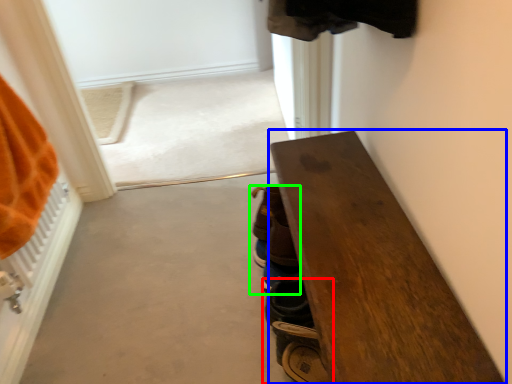
Question: Which is nearer to the footwear (highlighted by a red box)? furniture (highlighted by a blue box) or footwear (highlighted by a green box).

Choices:
 (A) furniture
 (B) footwear

Answer: (B)